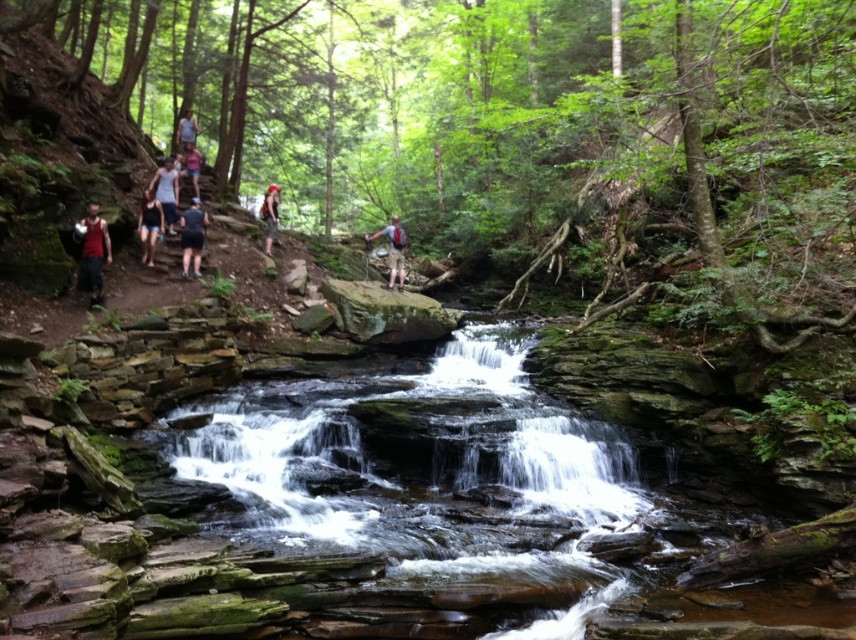
Consider the image. Between matte red tank top at left and matte red backpack at center, which one is positioned lower?

Positioned lower is matte red tank top at left.

Is point (90, 285) closer to viewer compared to point (276, 212)?

Yes.

Identify the location of matte red tank top at left. The image size is (856, 640). (93, 256).

Between smooth rock stream at center and matte red tank top at left, which one appears on the right side from the viewer's perspective?

smooth rock stream at center

Who is shorter, smooth rock stream at center or matte red tank top at left?

matte red tank top at left

Who is more distant from viewer, (522, 412) or (103, 257)?

Positioned behind is point (103, 257).

Locate an element on the screen. smooth rock stream at center is located at coordinates (428, 476).

Which of these two, matte gray tank top at center or matte red backpack at center, stands shorter?

Standing shorter between the two is matte gray tank top at center.

Between matte gray tank top at center and matte red backpack at center, which one is positioned higher?

matte red backpack at center

Which is behind, point (155, 184) or point (271, 256)?

Point (271, 256)

The width and height of the screenshot is (856, 640). What are the coordinates of `matte gray tank top at center` in the screenshot? It's located at (165, 193).